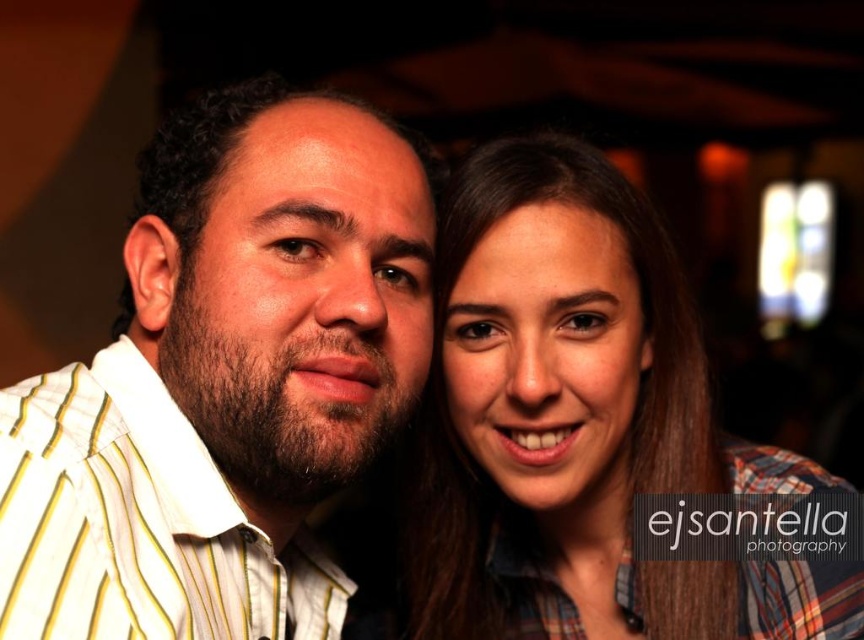
Question: Which point is farther from the camera taking this photo?

Choices:
 (A) (505, 340)
 (B) (386, 170)

Answer: (A)

Question: Which of the following is the farthest from the observer?

Choices:
 (A) plaid shirt at center
 (B) white striped shirt at center

Answer: (A)

Question: Is the position of white striped shirt at center more distant than that of plaid shirt at center?

Choices:
 (A) yes
 (B) no

Answer: (B)

Question: Which object appears farthest from the camera in this image?

Choices:
 (A) plaid shirt at center
 (B) white striped shirt at center

Answer: (A)

Question: Does white striped shirt at center appear on the left side of plaid shirt at center?

Choices:
 (A) yes
 (B) no

Answer: (A)

Question: Does white striped shirt at center appear over plaid shirt at center?

Choices:
 (A) yes
 (B) no

Answer: (A)